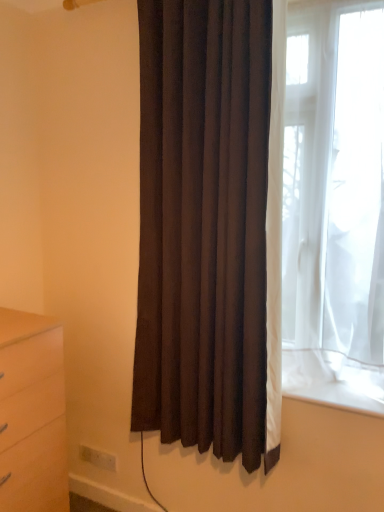
Question: Is white plastic electric outlet at lower left a part of matte wood chest of drawers at lower left?

Choices:
 (A) yes
 (B) no

Answer: (B)

Question: Does matte wood chest of drawers at lower left come in front of white plastic electric outlet at lower left?

Choices:
 (A) yes
 (B) no

Answer: (A)

Question: From the image's perspective, is matte wood chest of drawers at lower left over white plastic electric outlet at lower left?

Choices:
 (A) yes
 (B) no

Answer: (A)

Question: Is matte wood chest of drawers at lower left oriented towards white plastic electric outlet at lower left?

Choices:
 (A) yes
 (B) no

Answer: (B)

Question: Is matte wood chest of drawers at lower left to the left of white plastic electric outlet at lower left from the viewer's perspective?

Choices:
 (A) no
 (B) yes

Answer: (B)

Question: Does point (114, 459) appear closer or farther from the camera than point (26, 485)?

Choices:
 (A) closer
 (B) farther

Answer: (B)

Question: From the image's perspective, is white plastic electric outlet at lower left positioned above or below matte wood chest of drawers at lower left?

Choices:
 (A) above
 (B) below

Answer: (B)

Question: Considering the positions of white plastic electric outlet at lower left and matte wood chest of drawers at lower left in the image, is white plastic electric outlet at lower left wider or thinner than matte wood chest of drawers at lower left?

Choices:
 (A) thin
 (B) wide

Answer: (A)

Question: Considering the positions of white plastic electric outlet at lower left and matte wood chest of drawers at lower left in the image, is white plastic electric outlet at lower left taller or shorter than matte wood chest of drawers at lower left?

Choices:
 (A) tall
 (B) short

Answer: (B)

Question: Is dark brown fabric curtain at center in front of or behind white plastic electric outlet at lower left in the image?

Choices:
 (A) front
 (B) behind

Answer: (A)

Question: Is dark brown fabric curtain at center taller or shorter than white plastic electric outlet at lower left?

Choices:
 (A) tall
 (B) short

Answer: (A)

Question: In terms of width, does dark brown fabric curtain at center look wider or thinner when compared to white plastic electric outlet at lower left?

Choices:
 (A) thin
 (B) wide

Answer: (B)

Question: Considering the positions of dark brown fabric curtain at center and white plastic electric outlet at lower left in the image, is dark brown fabric curtain at center bigger or smaller than white plastic electric outlet at lower left?

Choices:
 (A) small
 (B) big

Answer: (B)

Question: Considering the positions of matte wood chest of drawers at lower left and white plastic electric outlet at lower left in the image, is matte wood chest of drawers at lower left taller or shorter than white plastic electric outlet at lower left?

Choices:
 (A) short
 (B) tall

Answer: (B)

Question: In terms of width, does matte wood chest of drawers at lower left look wider or thinner when compared to white plastic electric outlet at lower left?

Choices:
 (A) wide
 (B) thin

Answer: (A)